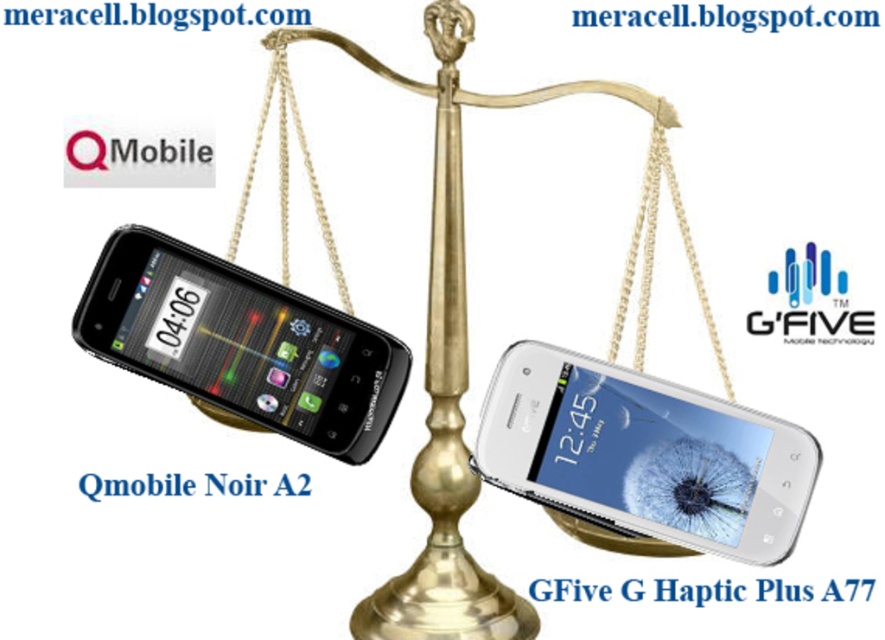
You are designing a display stand for two phones. The stand has two slots, one on the left and one on the right. The left slot can accommodate a phone up to 7 cm wide, and the right slot can hold a phone up to 6.5 cm wide. You have the white glossy smartphone at center and the black glossy qmobile noir a2 at left. Which phone should go in which slot to ensure they fit properly?

The black glossy qmobile noir a2 at left should go in the left slot since its width is greater than the white glossy smartphone at center, and the left slot can hold up to 7 cm. The white glossy smartphone at center should be placed in the right slot, which accommodates up to 6.5 cm, as its width is smaller.

You are a customer comparing two phones on a balance scale. The black glossy qmobile noir a2 at left is on the left side, and the white glossy smartphone at center is on the right side. Which phone is positioned to the right of the other?

The white glossy smartphone at center is to the right of the black glossy qmobile noir a2 at left.